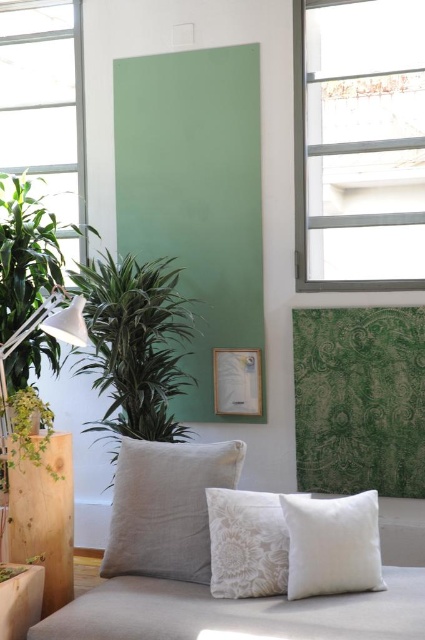
Question: Which point is closer to the camera taking this photo?

Choices:
 (A) (30, 324)
 (B) (393, 202)
 (C) (353, 531)

Answer: (C)

Question: Which of these objects is positioned farthest from the green leafy plant at left?

Choices:
 (A) white floral cushion at center
 (B) white fabric pillow at lower right
 (C) white textured pillow at center
 (D) clear glass window at upper right

Answer: (B)

Question: Is white fabric couch at lower center bigger than white textured pillow at center?

Choices:
 (A) yes
 (B) no

Answer: (A)

Question: Can you confirm if white fabric couch at lower center is wider than white matte lamp at left?

Choices:
 (A) yes
 (B) no

Answer: (A)

Question: Which of the following is the closest to the observer?

Choices:
 (A) (234, 577)
 (B) (166, 410)
 (C) (144, 525)
 (D) (73, 324)

Answer: (A)

Question: Does clear glass window at upper right have a smaller size compared to green leafy plant at left?

Choices:
 (A) yes
 (B) no

Answer: (A)